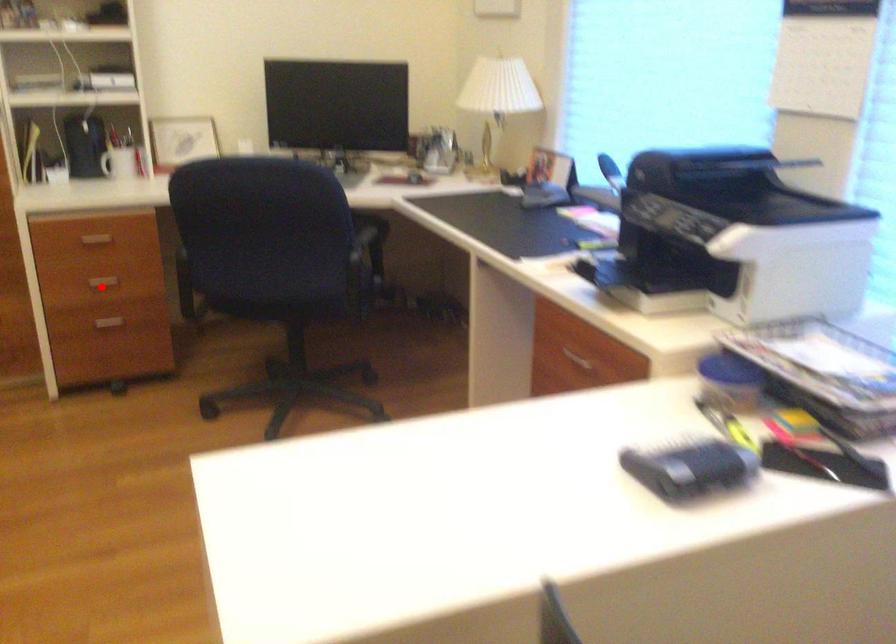
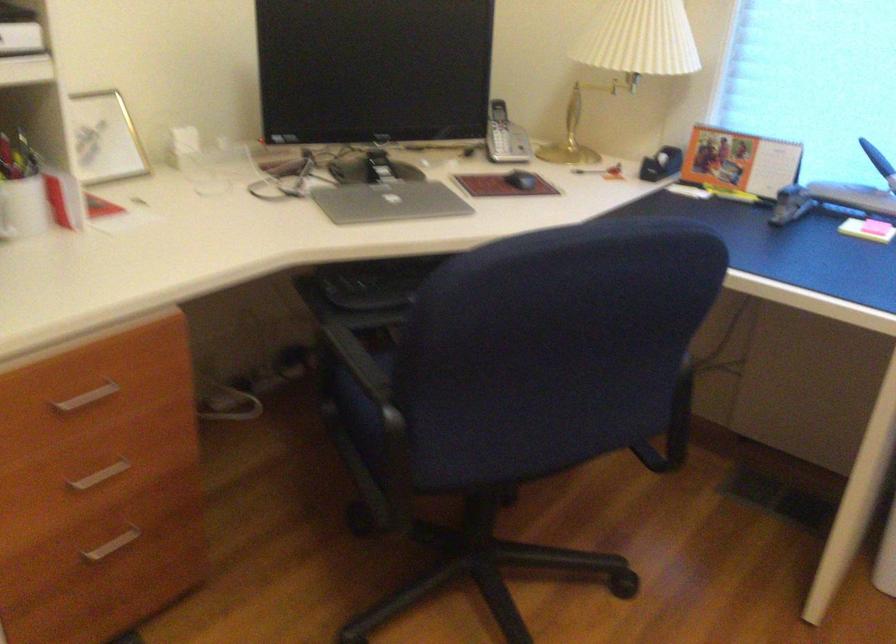
The point at the highlighted location is marked in the first image. Where is the corresponding point in the second image?

(99, 475)